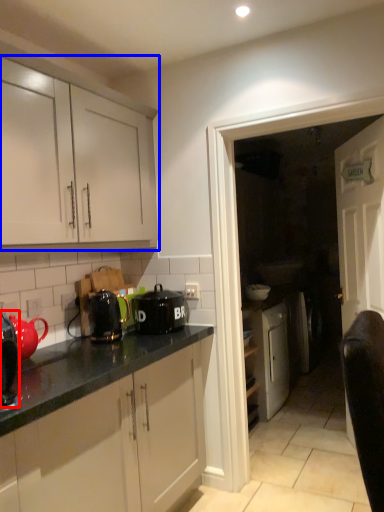
Question: Which point is closer to the camera, kitchen appliance (highlighted by a red box) or cabinetry (highlighted by a blue box)?

Choices:
 (A) kitchen appliance
 (B) cabinetry

Answer: (A)